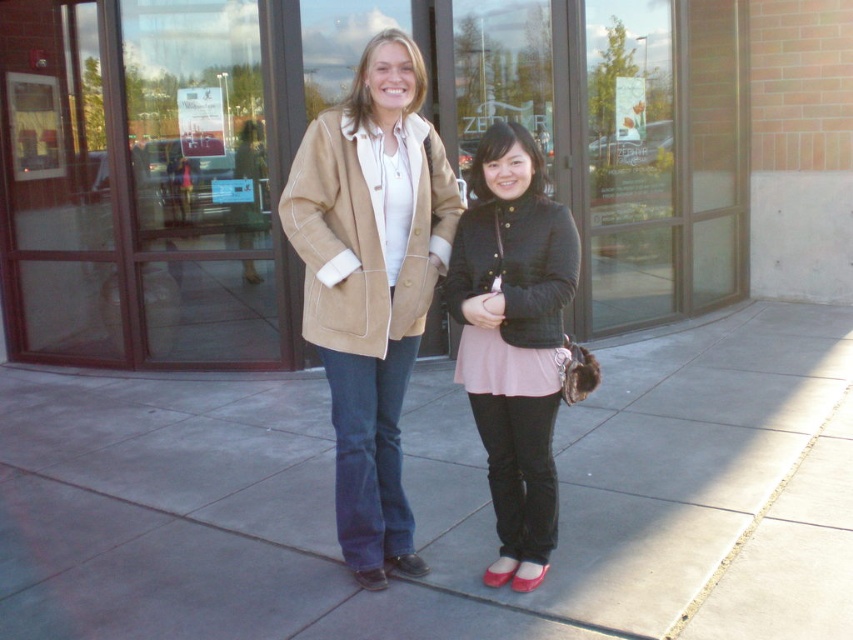
Is transparent glass door at upper left smaller than tan suede coat at center?

No, transparent glass door at upper left is not smaller than tan suede coat at center.

Between point (117, 10) and point (422, 225), which one is positioned in front?

Point (422, 225)

Is point (282, 122) in front of point (428, 205)?

That is False.

This screenshot has width=853, height=640. I want to click on transparent glass door at upper left, so click(x=148, y=180).

Can you confirm if gray concrete sidewalk at center is positioned above transparent glass door at upper left?

No, gray concrete sidewalk at center is not above transparent glass door at upper left.

Who is taller, gray concrete sidewalk at center or transparent glass door at upper left?

With more height is transparent glass door at upper left.

Who is more forward, (709, 547) or (241, 106)?

Point (709, 547)

I want to click on gray concrete sidewalk at center, so click(x=442, y=499).

Does matte black jacket at center appear on the left side of tan suede coat at center?

In fact, matte black jacket at center is to the right of tan suede coat at center.

The height and width of the screenshot is (640, 853). Describe the element at coordinates (514, 339) in the screenshot. I see `matte black jacket at center` at that location.

Identify the location of matte black jacket at center. The width and height of the screenshot is (853, 640). (514, 339).